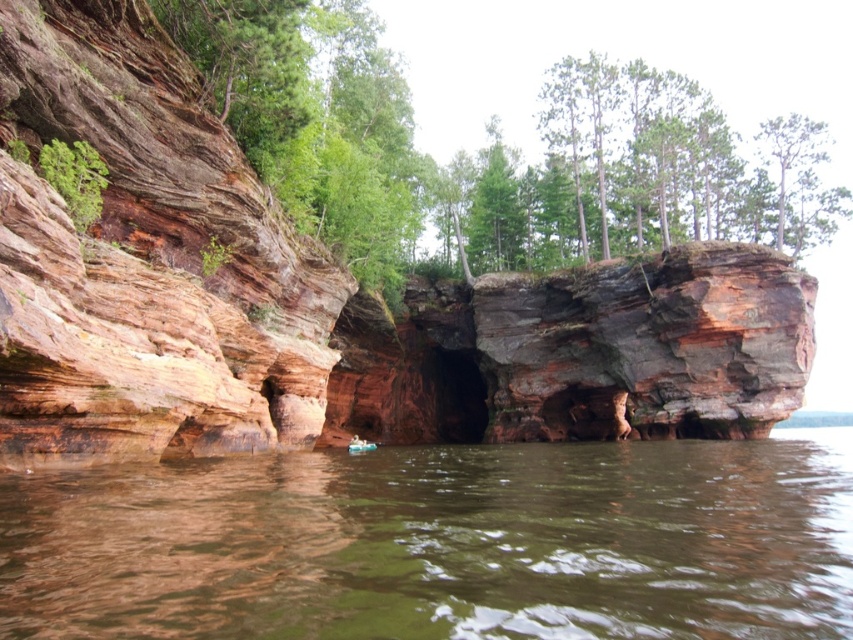
Is rustic stone cliff at center thinner than green rough bark tree at upper center?

Indeed, rustic stone cliff at center has a lesser width compared to green rough bark tree at upper center.

Is point (228, 264) less distant than point (244, 74)?

No, it is behind (244, 74).

Does point (260, 323) come behind point (256, 58)?

That is True.

The image size is (853, 640). I want to click on rustic stone cliff at center, so click(144, 259).

Does brown sedimentary rock at center lie behind green rough bark tree at upper center?

No, it is in front of green rough bark tree at upper center.

Which is more to the right, brown sedimentary rock at center or green rough bark tree at upper center?

From the viewer's perspective, green rough bark tree at upper center appears more on the right side.

Does point (50, 550) come behind point (689, 106)?

No, (50, 550) is in front of (689, 106).

You are a GUI agent. You are given a task and a screenshot of the screen. Output one action in this format:
    pyautogui.click(x=<x>, y=<y>)
    Task: Click on the brown sedimentary rock at center
    This screenshot has height=640, width=853.
    Given the screenshot: What is the action you would take?
    pyautogui.click(x=440, y=544)

Consider the image. Can you confirm if brown sedimentary rock at center is positioned above rustic stone cliff at center?

No, brown sedimentary rock at center is not above rustic stone cliff at center.

Which of these two, brown sedimentary rock at center or rustic stone cliff at center, stands taller?

Standing taller between the two is rustic stone cliff at center.

Image resolution: width=853 pixels, height=640 pixels. In order to click on brown sedimentary rock at center in this screenshot , I will do `click(440, 544)`.

Locate an element on the screen. brown sedimentary rock at center is located at coordinates (440, 544).